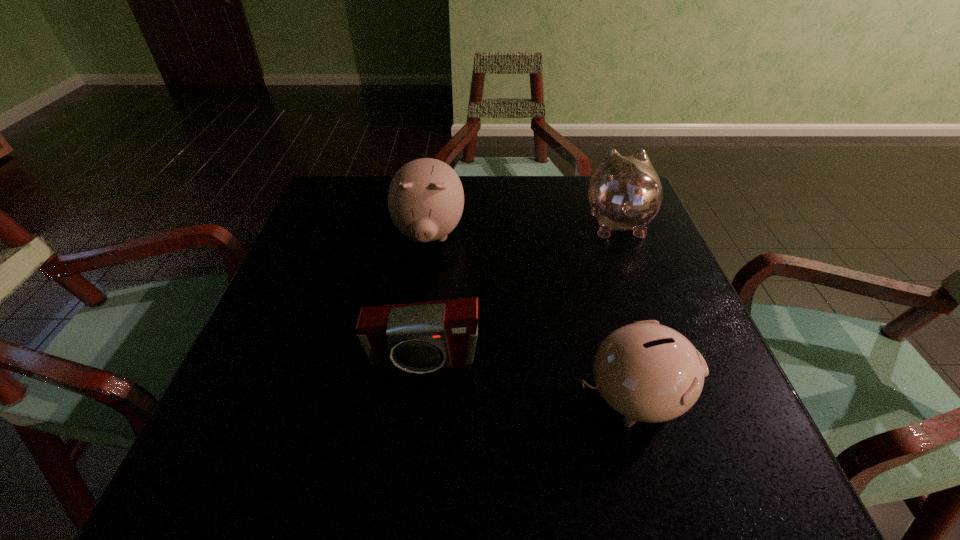
Find the location of a particular element. The image size is (960, 540). the leftmost piggy bank is located at coordinates (425, 199).

At what (x,y) coordinates should I click in order to perform the action: click on the shortest piggy bank. Please return your answer as a coordinate pair (x, y). Image resolution: width=960 pixels, height=540 pixels. Looking at the image, I should click on (647, 372).

Identify the location of camera. point(421,337).

This screenshot has width=960, height=540. Find the location of `free space located 0.060m at the snout of the leftmost piggy bank`. free space located 0.060m at the snout of the leftmost piggy bank is located at coordinates (422, 286).

Identify the location of vacant position located on the left of the shortest piggy bank. (346, 398).

Find the location of a particular element. vacant space located 0.130m on the front-facing side of the camera is located at coordinates (412, 453).

Image resolution: width=960 pixels, height=540 pixels. What are the coordinates of `object present at the near edge` in the screenshot? It's located at (647, 372).

The width and height of the screenshot is (960, 540). I want to click on object present at the far right corner, so click(625, 192).

In order to click on object that is at the near right corner in this screenshot , I will do `click(647, 372)`.

In the image, there is a desktop. At what (x,y) coordinates should I click in order to perform the action: click on free space at the far edge. Please return your answer as a coordinate pair (x, y). This screenshot has width=960, height=540. Looking at the image, I should click on (476, 197).